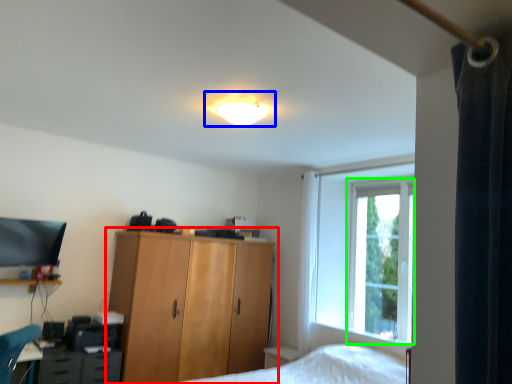
Question: Considering the real-world distances, which object is closest to cupboard (highlighted by a red box)? lamp (highlighted by a blue box) or window screen (highlighted by a green box).

Choices:
 (A) lamp
 (B) window screen

Answer: (B)